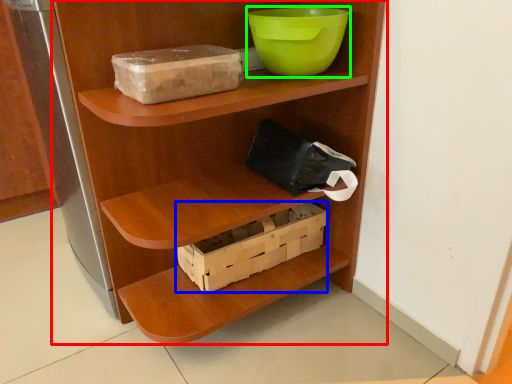
Question: Considering the real-world distances, which object is farthest from shelf (highlighted by a red box)? box (highlighted by a blue box) or bowl (highlighted by a green box)?

Choices:
 (A) box
 (B) bowl

Answer: (B)